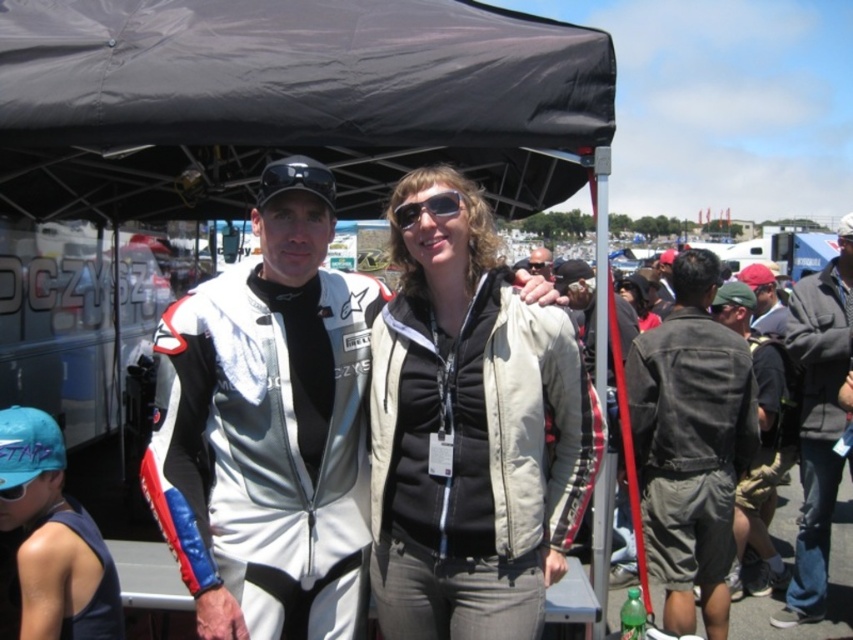
In the scene shown: You are a photographer setting up a tripod in this scene. You need to place the tripod so it doesn not block the blue fabric cap at lower left or the sunglasses at center. Which object requires more horizontal space for the tripod placement?

The blue fabric cap at lower left might be wider than sunglasses at center, so it requires more horizontal space for the tripod placement to avoid blocking it.

You are a photographer trying to capture a clear shot of the dark gray jacket at right without the black fabric tent at upper center blocking the view. Is this possible given their positions?

The black fabric tent at upper center is closer to the viewer than the dark gray jacket at right, so it will block the view of the dark gray jacket at right unless you move to a different angle or position.